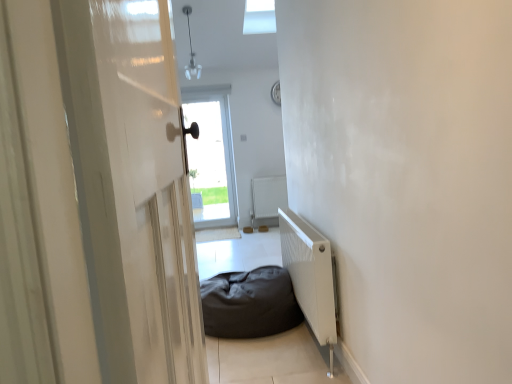
Identify the location of dark fabric bean bag at center. (249, 303).

The width and height of the screenshot is (512, 384). What do you see at coordinates (150, 188) in the screenshot?
I see `white glossy door at left` at bounding box center [150, 188].

Locate an element on the screen. Image resolution: width=512 pixels, height=384 pixels. white matte radiator at center, the 1th radiator in the back-to-front sequence is located at coordinates pyautogui.click(x=268, y=196).

Who is bigger, white matte radiator at lower right, arranged as the 1th radiator when viewed from the front, or transparent glass door at center?

With larger size is transparent glass door at center.

Could you tell me if white matte radiator at lower right, arranged as the 1th radiator when viewed from the front, is turned towards transparent glass door at center?

No, white matte radiator at lower right, arranged as the 1th radiator when viewed from the front, is not turned towards transparent glass door at center.

Between white matte radiator at lower right, acting as the second radiator starting from the back, and transparent glass door at center, which one appears on the right side from the viewer's perspective?

white matte radiator at lower right, acting as the second radiator starting from the back, is more to the right.

Is white glossy door at left to the left or to the right of white matte radiator at lower right, arranged as the 1th radiator when viewed from the front, in the image?

In the image, white glossy door at left appears on the left side of white matte radiator at lower right, arranged as the 1th radiator when viewed from the front.

Does point (159, 310) come farther from viewer compared to point (289, 241)?

No, it is in front of (289, 241).

From the image's perspective, is white glossy door at left on white matte radiator at lower right, acting as the second radiator starting from the back?

Indeed, from the image's perspective, white glossy door at left is shown above white matte radiator at lower right, acting as the second radiator starting from the back.

Considering the sizes of objects white glossy door at left and white matte radiator at lower right, arranged as the 1th radiator when viewed from the front, in the image provided, who is thinner, white glossy door at left or white matte radiator at lower right, arranged as the 1th radiator when viewed from the front,?

white matte radiator at lower right, arranged as the 1th radiator when viewed from the front, is thinner.

There is a dark fabric bean bag at center. Identify the location of screen door above it (from a real-world perspective). (150, 188).

How many degrees apart are the facing directions of white glossy door at left and dark fabric bean bag at center?

There is a 176-degree angle between the facing directions of white glossy door at left and dark fabric bean bag at center.

Is white glossy door at left oriented away from dark fabric bean bag at center?

white glossy door at left is not turned away from dark fabric bean bag at center.

Is point (216, 175) closer or farther from the camera than point (112, 129)?

Point (216, 175).

Is transparent glass door at center far away from white glossy door at left?

transparent glass door at center is far away from white glossy door at left.

Relative to white glossy door at left, is transparent glass door at center in front or behind?

transparent glass door at center is positioned farther from the viewer than white glossy door at left.

Which of these two, white matte radiator at center, the 1th radiator in the back-to-front sequence, or transparent glass door at center, stands taller?

With more height is transparent glass door at center.

Considering the positions of objects white matte radiator at center, the 1th radiator in the back-to-front sequence, and transparent glass door at center in the image provided, who is in front, white matte radiator at center, the 1th radiator in the back-to-front sequence, or transparent glass door at center?

white matte radiator at center, the 1th radiator in the back-to-front sequence, is closer to the camera.

Consider the image. Is white matte radiator at center, which ranks as the second radiator in front-to-back order, looking in the opposite direction of transparent glass door at center?

No, white matte radiator at center, which ranks as the second radiator in front-to-back order, is not facing away from transparent glass door at center.

Considering the sizes of objects white matte radiator at center, which ranks as the second radiator in front-to-back order, and transparent glass door at center in the image provided, who is thinner, white matte radiator at center, which ranks as the second radiator in front-to-back order, or transparent glass door at center?

white matte radiator at center, which ranks as the second radiator in front-to-back order, is thinner.

From the image's perspective, between dark fabric bean bag at center and white matte radiator at lower right, acting as the second radiator starting from the back, who is located below?

dark fabric bean bag at center.

Which object is positioned more to the right, dark fabric bean bag at center or white matte radiator at lower right, arranged as the 1th radiator when viewed from the front?

Positioned to the right is white matte radiator at lower right, arranged as the 1th radiator when viewed from the front.

Is dark fabric bean bag at center in front of or behind white matte radiator at lower right, acting as the second radiator starting from the back, in the image?

dark fabric bean bag at center is positioned farther from the viewer than white matte radiator at lower right, acting as the second radiator starting from the back.

What's the angular difference between transparent glass door at center and white matte radiator at lower right, acting as the second radiator starting from the back,'s facing directions?

The angle between the facing direction of transparent glass door at center and the facing direction of white matte radiator at lower right, acting as the second radiator starting from the back, is 89.9 degrees.

Could you tell me if transparent glass door at center is turned towards white matte radiator at lower right, acting as the second radiator starting from the back?

Yes, transparent glass door at center faces towards white matte radiator at lower right, acting as the second radiator starting from the back.

Which object is further away from the camera taking this photo, transparent glass door at center or white matte radiator at lower right, arranged as the 1th radiator when viewed from the front?

Positioned behind is transparent glass door at center.

Locate an element on the screen. This screenshot has width=512, height=384. window that is above the white matte radiator at lower right, arranged as the 1th radiator when viewed from the front (from the image's perspective) is located at coordinates (211, 158).

Find the location of a particular element. screen door in front of the white matte radiator at lower right, acting as the second radiator starting from the back is located at coordinates 150,188.

When comparing their distances from white glossy door at left, does white matte radiator at lower right, acting as the second radiator starting from the back, or dark fabric bean bag at center seem further?

The object further to white glossy door at left is dark fabric bean bag at center.

Based on their spatial positions, is white matte radiator at center, the 1th radiator in the back-to-front sequence, or transparent glass door at center further from white matte radiator at lower right, acting as the second radiator starting from the back?

transparent glass door at center is positioned further to the anchor white matte radiator at lower right, acting as the second radiator starting from the back.

Looking at the image, which one is located closer to white glossy door at left, white matte radiator at center, the 1th radiator in the back-to-front sequence, or transparent glass door at center?

transparent glass door at center is positioned closer to the anchor white glossy door at left.

Considering their positions, is white matte radiator at lower right, acting as the second radiator starting from the back, positioned further to dark fabric bean bag at center than white glossy door at left?

The object further to dark fabric bean bag at center is white glossy door at left.

Considering their positions, is dark fabric bean bag at center positioned further to transparent glass door at center than white matte radiator at center, the 1th radiator in the back-to-front sequence?

Among the two, dark fabric bean bag at center is located further to transparent glass door at center.

Which object lies nearer to the anchor point white glossy door at left, white matte radiator at lower right, acting as the second radiator starting from the back, or transparent glass door at center?

white matte radiator at lower right, acting as the second radiator starting from the back, is positioned closer to the anchor white glossy door at left.

Considering their positions, is white matte radiator at center, which ranks as the second radiator in front-to-back order, positioned closer to transparent glass door at center than dark fabric bean bag at center?

white matte radiator at center, which ranks as the second radiator in front-to-back order.

In the scene shown: Based on their spatial positions, is dark fabric bean bag at center or white glossy door at left closer to transparent glass door at center?

Based on the image, dark fabric bean bag at center appears to be nearer to transparent glass door at center.

The image size is (512, 384). In order to click on furniture between white matte radiator at lower right, acting as the second radiator starting from the back, and white matte radiator at center, the 1th radiator in the back-to-front sequence, along the z-axis in this screenshot , I will do `click(249, 303)`.

Locate an element on the screen. The height and width of the screenshot is (384, 512). furniture located between white glossy door at left and transparent glass door at center in the depth direction is located at coordinates (249, 303).

Find the location of a particular element. The width and height of the screenshot is (512, 384). radiator between dark fabric bean bag at center and transparent glass door at center in the front-back direction is located at coordinates (268, 196).

Locate an element on the screen. This screenshot has height=384, width=512. furniture located between white glossy door at left and white matte radiator at center, which ranks as the second radiator in front-to-back order, in the depth direction is located at coordinates (249, 303).